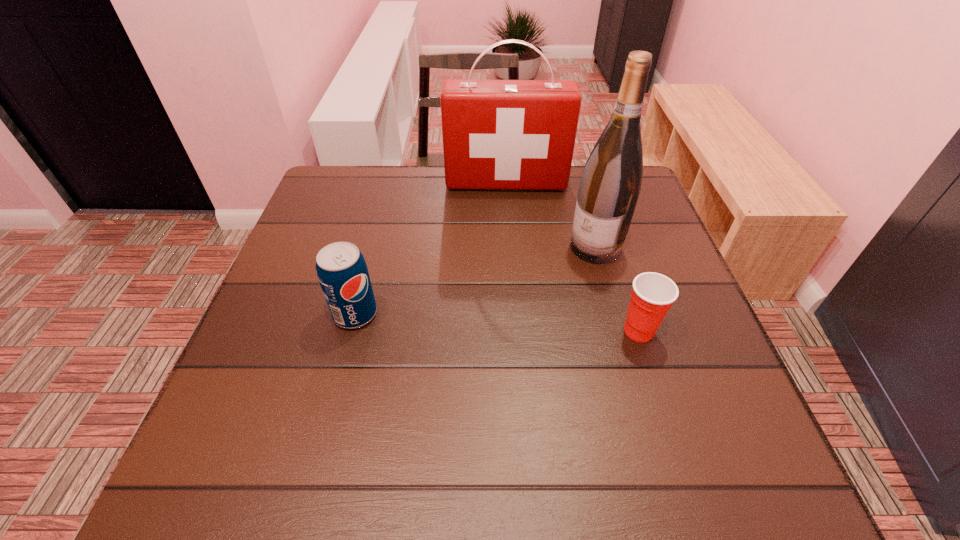
You are a GUI agent. You are given a task and a screenshot of the screen. Output one action in this format:
    pyautogui.click(x=<x>, y=<y>)
    Task: Click on the empty space between the second farthest object and the Dixie cup
    The width and height of the screenshot is (960, 540).
    Given the screenshot: What is the action you would take?
    pyautogui.click(x=617, y=289)

Locate an element on the screen. The image size is (960, 540). free point between the Dixie cup and the wine bottle is located at coordinates (617, 289).

What are the coordinates of `empty space that is in between the Dixie cup and the second shortest object` in the screenshot? It's located at (497, 322).

The image size is (960, 540). Find the location of `vacant point located between the leftmost object and the Dixie cup`. vacant point located between the leftmost object and the Dixie cup is located at coordinates (497, 322).

Point out which object is positioned as the third nearest to the leftmost object. Please provide its 2D coordinates. Your answer should be formatted as a tuple, i.e. [(x, y)], where the tuple contains the x and y coordinates of a point satisfying the conditions above.

[(653, 294)]

Identify which object is the closest to the first-aid kit. Please provide its 2D coordinates. Your answer should be formatted as a tuple, i.e. [(x, y)], where the tuple contains the x and y coordinates of a point satisfying the conditions above.

[(610, 185)]

Locate an element on the screen. The image size is (960, 540). vacant region that satisfies the following two spatial constraints: 1. on the front side of the Dixie cup; 2. on the left side of the leftmost object is located at coordinates (350, 331).

Identify the location of vacant space that satisfies the following two spatial constraints: 1. on the back side of the second shortest object; 2. on the left side of the wine bottle. The height and width of the screenshot is (540, 960). pos(372,248).